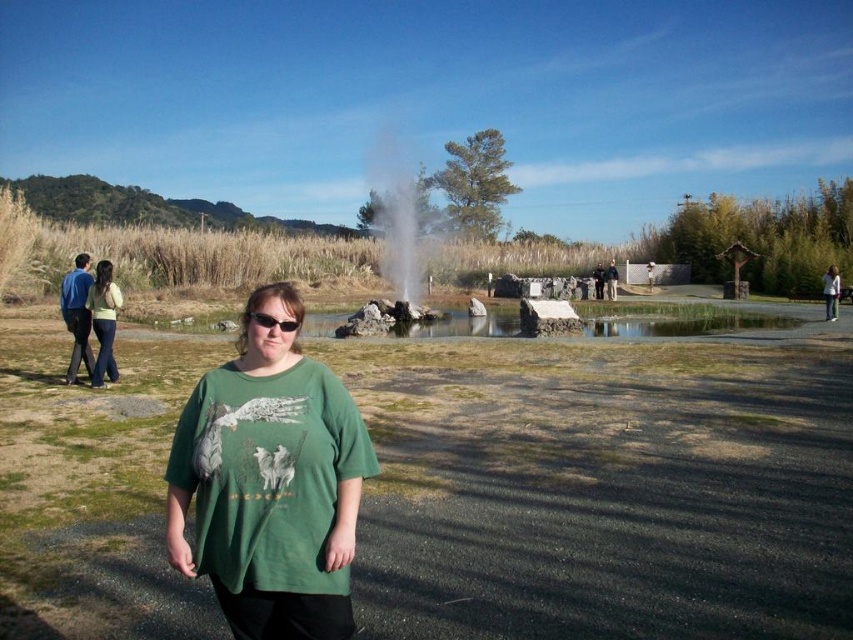
Question: Considering the relative positions of green fabric park at center and green cotton shirt at center in the image provided, where is green fabric park at center located with respect to green cotton shirt at center?

Choices:
 (A) left
 (B) right

Answer: (A)

Question: Considering the relative positions of green cotton shirt at center and black plastic sunglasses at center in the image provided, where is green cotton shirt at center located with respect to black plastic sunglasses at center?

Choices:
 (A) below
 (B) above

Answer: (A)

Question: Does white smoke at center come in front of dark gray uniform at center?

Choices:
 (A) yes
 (B) no

Answer: (A)

Question: Estimate the real-world distances between objects in this image. Which object is farther from the clear stone pond at center?

Choices:
 (A) white smoke at center
 (B) dark gray uniform at center
 (C) green cotton shirt at left

Answer: (C)

Question: Which is farther from the dark gray uniform at center?

Choices:
 (A) matte black jacket at center
 (B) black plastic sunglasses at center
 (C) clear stone pond at center

Answer: (B)

Question: Which of these objects is positioned closest to the green fabric park at center?

Choices:
 (A) green cotton shirt at left
 (B) dark gray uniform at center
 (C) green cotton shirt at center

Answer: (A)